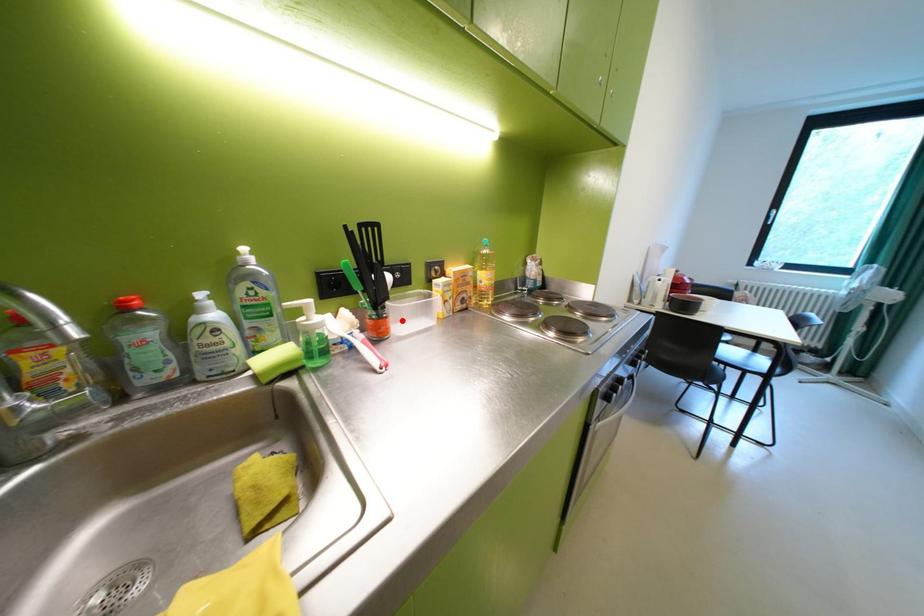
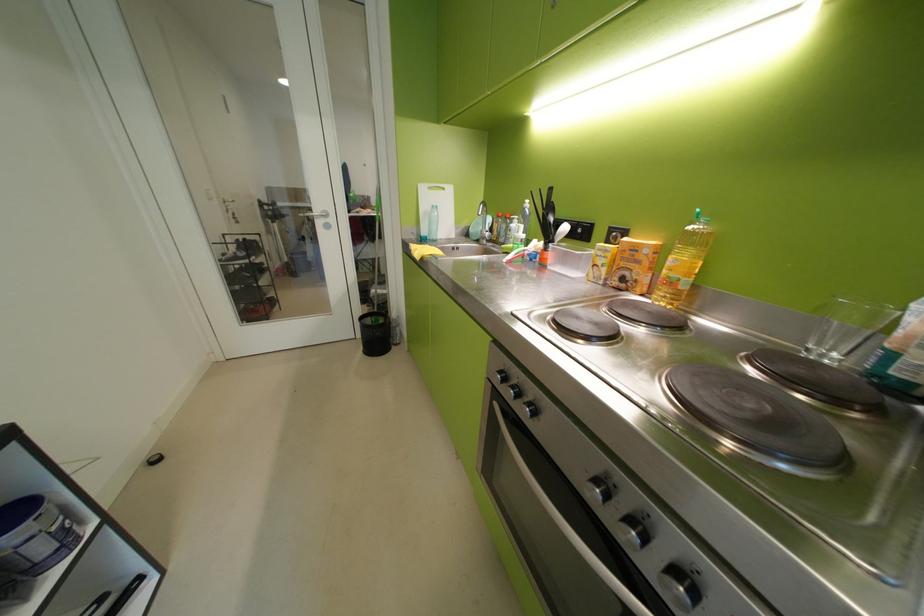
Find the pixel in the second image that matches the highlighted location in the first image.

(561, 256)